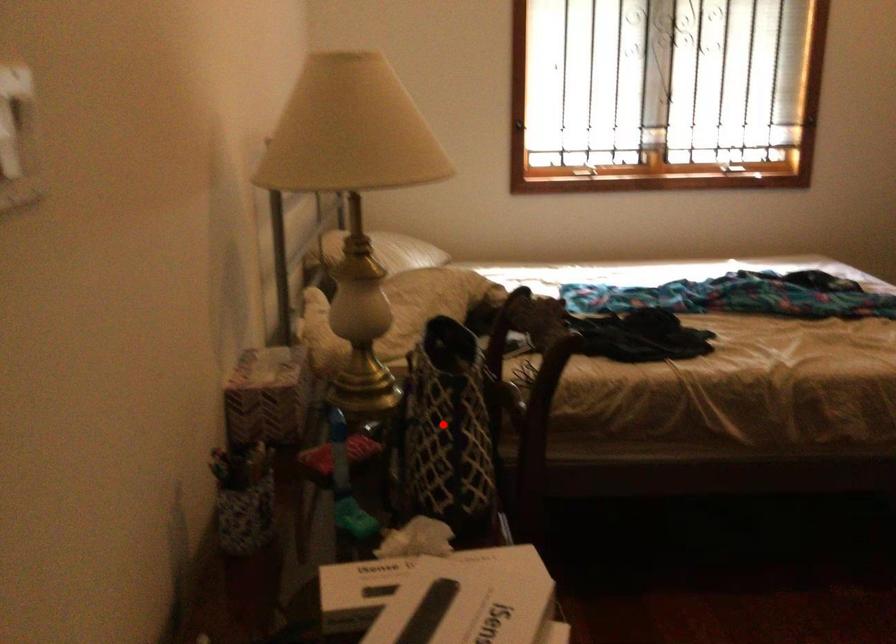
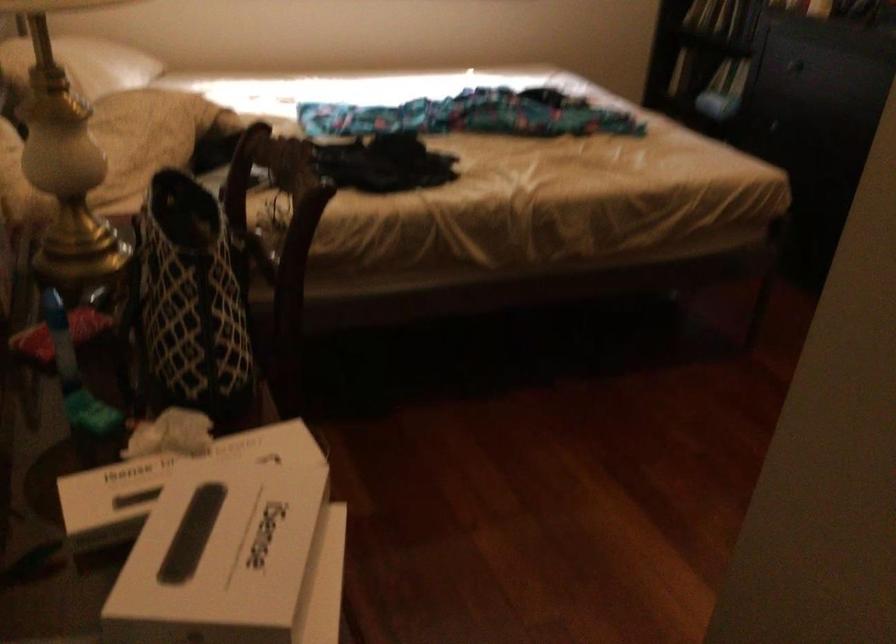
Question: I am providing you with two images of the same scene from different viewpoints. Image1 has a red point marked. In image2, the corresponding 3D location appears at what relative position? Reply with the corresponding letter.

Choices:
 (A) Closer
 (B) Farther

Answer: (A)